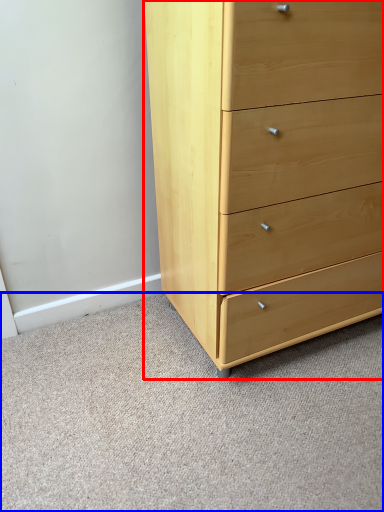
Question: Which object is further to the camera taking this photo, chest of drawers (highlighted by a red box) or plain (highlighted by a blue box)?

Choices:
 (A) chest of drawers
 (B) plain

Answer: (A)